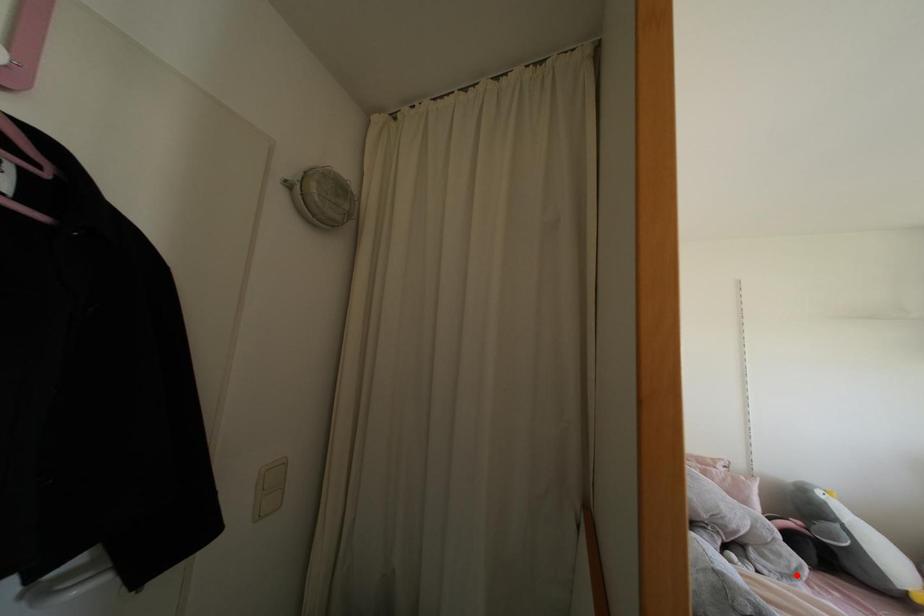
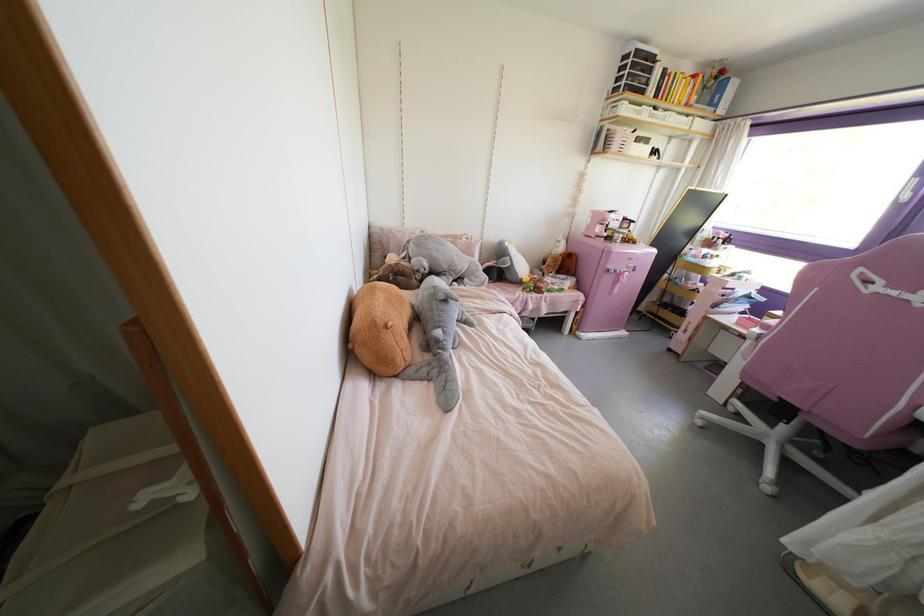
Where in the second image is the point corresponding to the highlighted location from the first image?

(482, 284)